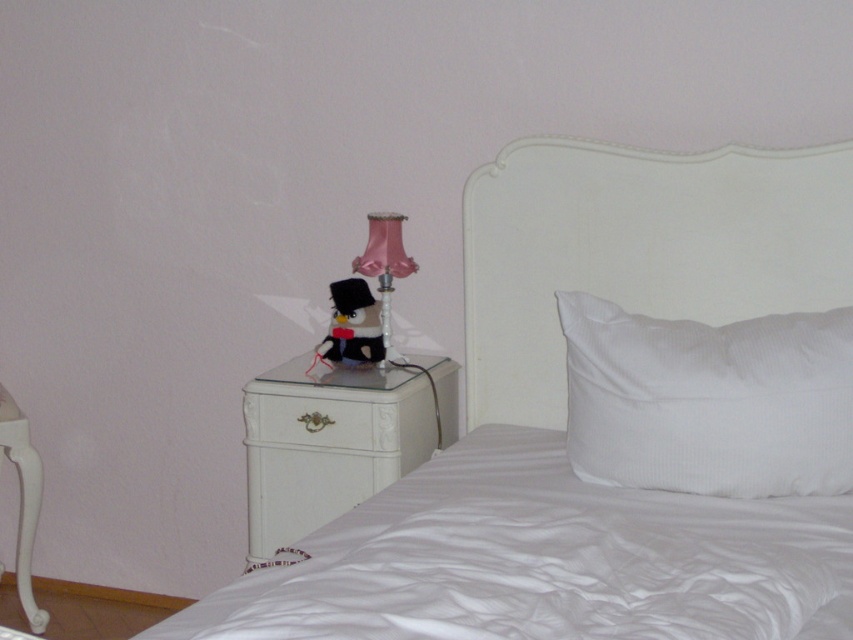
Question: Which of these objects is positioned closest to the white glossy drawer at lower left?

Choices:
 (A) velvet black plush at upper center
 (B) white matte headboard at upper right
 (C) white glossy dresser at lower left
 (D) pink satin lamp at upper right

Answer: (C)

Question: Is white matte headboard at upper right bigger than white glossy dresser at lower left?

Choices:
 (A) no
 (B) yes

Answer: (B)

Question: Where is white matte headboard at upper right located in relation to white glossy drawer at lower left in the image?

Choices:
 (A) below
 (B) above

Answer: (B)

Question: Estimate the real-world distances between objects in this image. Which object is farther from the white glossy dresser at lower left?

Choices:
 (A) white glossy drawer at lower left
 (B) white smooth pillow at upper right
 (C) white satin bed at center

Answer: (B)

Question: Among these points, which one is farthest from the camera?

Choices:
 (A) (741, 422)
 (B) (335, 445)
 (C) (529, 200)
 (D) (399, 250)

Answer: (D)

Question: Is white satin bed at center to the right of white smooth pillow at upper right from the viewer's perspective?

Choices:
 (A) yes
 (B) no

Answer: (B)